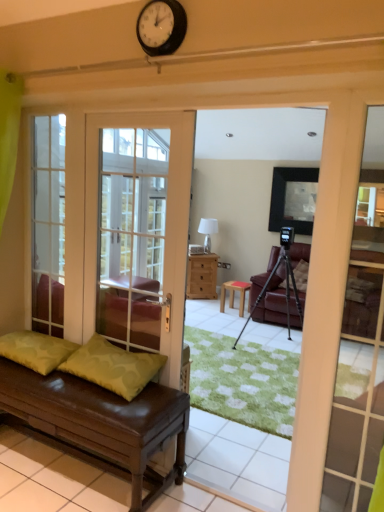
Question: From a real-world perspective, does clear glass door at left sit lower than brown leather bench at lower left?

Choices:
 (A) no
 (B) yes

Answer: (A)

Question: Is clear glass door at left located outside brown leather bench at lower left?

Choices:
 (A) no
 (B) yes

Answer: (B)

Question: Can you confirm if clear glass door at left is thinner than brown leather bench at lower left?

Choices:
 (A) no
 (B) yes

Answer: (B)

Question: Is clear glass door at left positioned in front of brown leather bench at lower left?

Choices:
 (A) yes
 (B) no

Answer: (B)

Question: Can you confirm if clear glass door at left is smaller than brown leather bench at lower left?

Choices:
 (A) yes
 (B) no

Answer: (A)

Question: Is clear glass door at left directly adjacent to brown leather bench at lower left?

Choices:
 (A) no
 (B) yes

Answer: (A)

Question: Is the position of matte black frame at upper center less distant than that of wooden stool at center?

Choices:
 (A) yes
 (B) no

Answer: (A)

Question: Could you tell me if matte black frame at upper center is turned towards wooden stool at center?

Choices:
 (A) yes
 (B) no

Answer: (B)

Question: Can you confirm if matte black frame at upper center is thinner than wooden stool at center?

Choices:
 (A) no
 (B) yes

Answer: (B)

Question: Is matte black frame at upper center wider than wooden stool at center?

Choices:
 (A) yes
 (B) no

Answer: (B)

Question: Is matte black frame at upper center at the left side of wooden stool at center?

Choices:
 (A) yes
 (B) no

Answer: (B)

Question: Are matte black frame at upper center and wooden stool at center far apart?

Choices:
 (A) no
 (B) yes

Answer: (B)

Question: Is matte black frame at upper center shorter than white face clock at upper center?

Choices:
 (A) yes
 (B) no

Answer: (B)